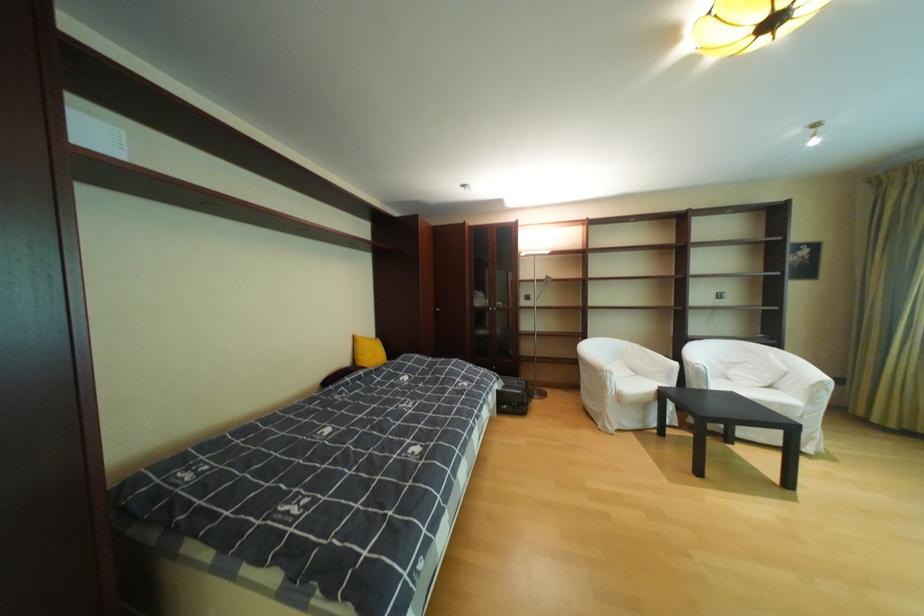
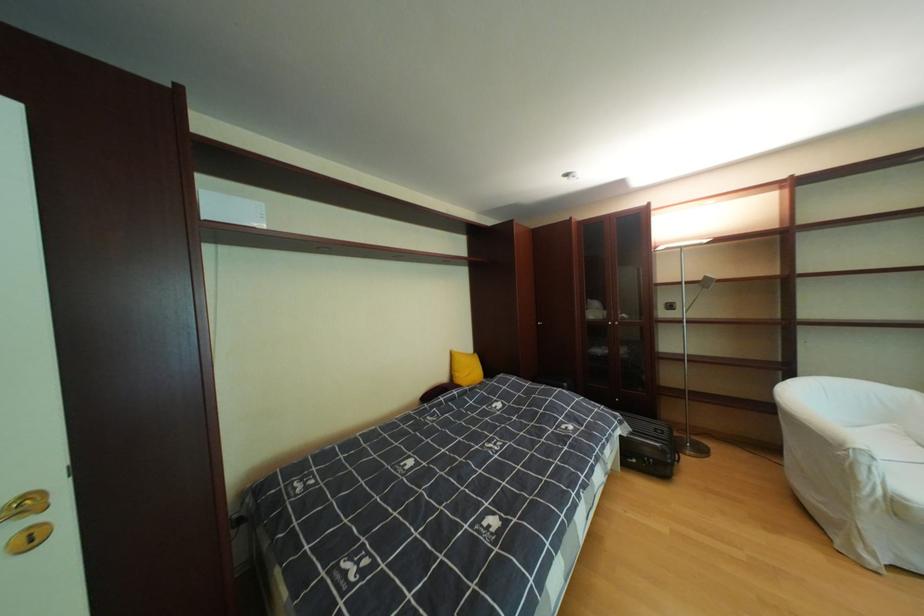
Where in the second image is the point corresponding to point (630, 397) from the first image?

(908, 506)